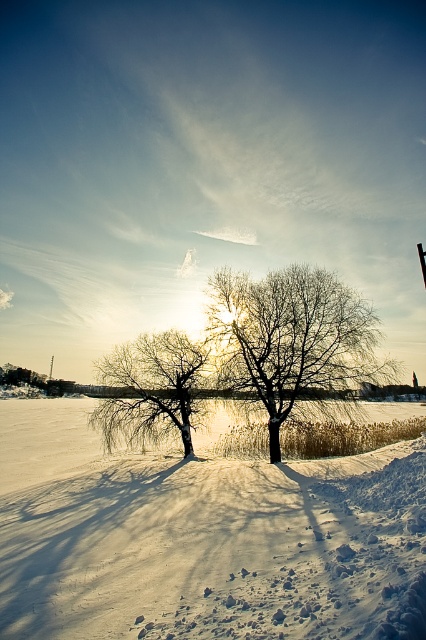
Is white powdery snow at center to the right of bare wood tree at center from the viewer's perspective?

No, white powdery snow at center is not to the right of bare wood tree at center.

Can you confirm if white powdery snow at center is positioned to the left of bare wood tree at center?

Yes, white powdery snow at center is to the left of bare wood tree at center.

The width and height of the screenshot is (426, 640). Find the location of `white powdery snow at center`. white powdery snow at center is located at coordinates (201, 538).

Where is `white powdery snow at center`? white powdery snow at center is located at coordinates (201, 538).

Is point (244, 326) positioned in front of point (187, 444)?

Yes, point (244, 326) is in front of point (187, 444).

Between bare wood tree at center and snow-covered tree at center, which one appears on the right side from the viewer's perspective?

bare wood tree at center

I want to click on bare wood tree at center, so click(290, 337).

Can you confirm if white powdery snow at center is positioned below snow-covered tree at center?

No.

Is white powdery snow at center smaller than snow-covered tree at center?

No, white powdery snow at center is not smaller than snow-covered tree at center.

Where is `white powdery snow at center`? The height and width of the screenshot is (640, 426). white powdery snow at center is located at coordinates click(201, 538).

In order to click on white powdery snow at center in this screenshot , I will do `click(201, 538)`.